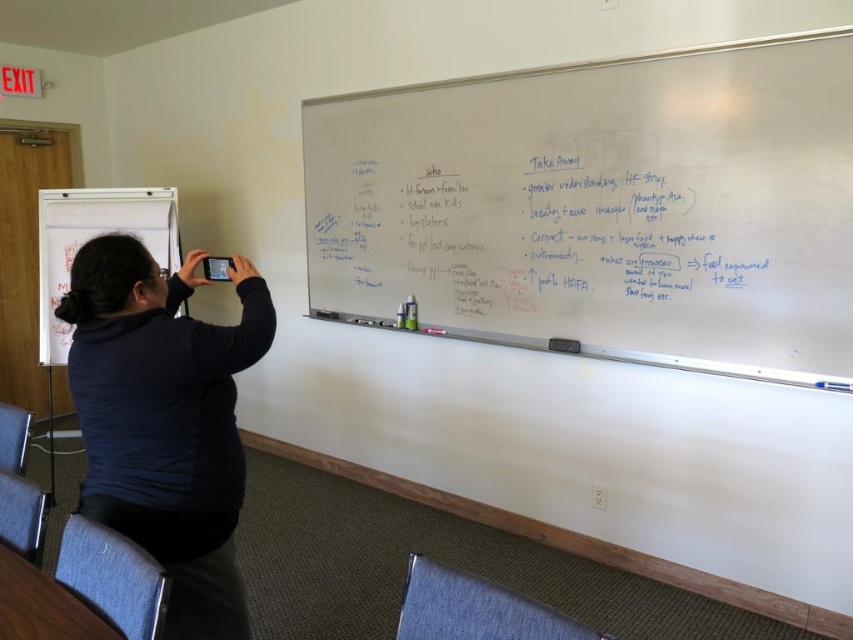
Can you confirm if dark blue sweater at lower left is positioned above whiteboard at left?

Actually, dark blue sweater at lower left is below whiteboard at left.

Between dark blue sweater at lower left and whiteboard at left, which one is positioned lower?

dark blue sweater at lower left

You are a GUI agent. You are given a task and a screenshot of the screen. Output one action in this format:
    pyautogui.click(x=<x>, y=<y>)
    Task: Click on the dark blue sweater at lower left
    The width and height of the screenshot is (853, 640).
    Given the screenshot: What is the action you would take?
    pyautogui.click(x=165, y=419)

Which of these two, whiteboard at upper right or whiteboard at left, stands shorter?

With less height is whiteboard at left.

Does point (608, 232) come behind point (142, 212)?

No.

Find the location of `whiteboard at upper right`. whiteboard at upper right is located at coordinates (602, 209).

Which of these two, whiteboard at upper right or dark blue sweater at lower left, stands shorter?

Standing shorter between the two is dark blue sweater at lower left.

Who is positioned more to the left, whiteboard at upper right or dark blue sweater at lower left?

From the viewer's perspective, dark blue sweater at lower left appears more on the left side.

Locate an element on the screen. The image size is (853, 640). whiteboard at upper right is located at coordinates (602, 209).